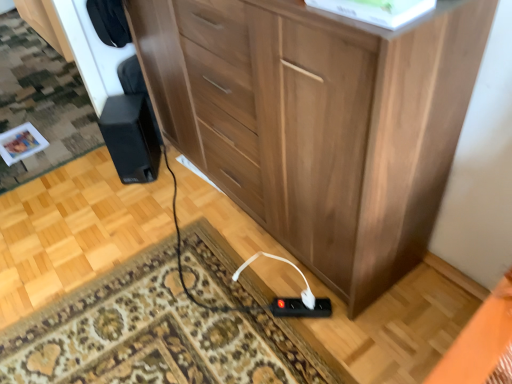
The height and width of the screenshot is (384, 512). Identify the location of vacant area that lies in front of black plastic power strip at lower center, which is counted as the 2th plug, starting from the right. click(313, 352).